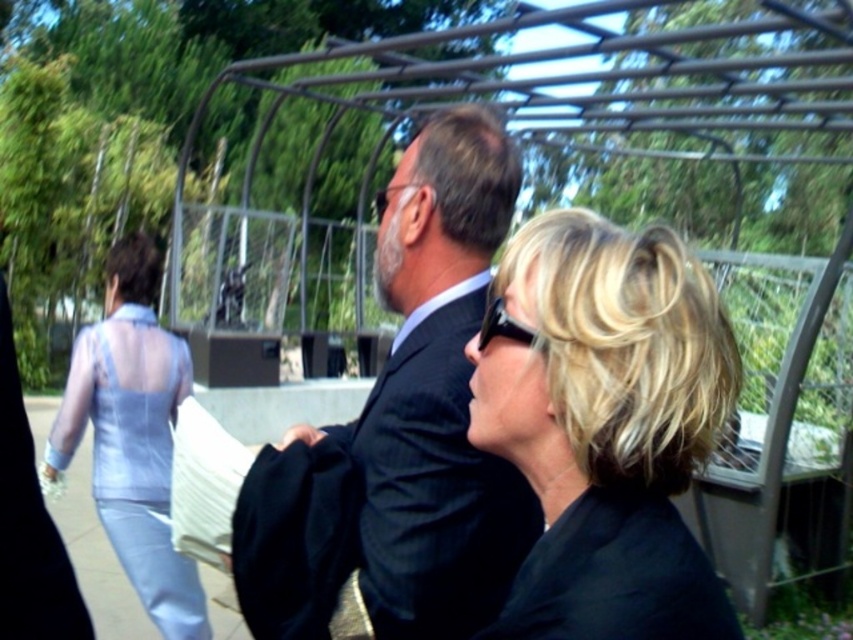
Question: Which of the following is the farthest from the observer?

Choices:
 (A) (497, 163)
 (B) (131, 545)

Answer: (B)

Question: Which object appears closest to the camera in this image?

Choices:
 (A) dark gray suit at center
 (B) blonde hair at center

Answer: (B)

Question: Which of these objects is positioned closest to the blonde hair at center?

Choices:
 (A) light blue sheer dress at left
 (B) dark gray suit at center

Answer: (B)

Question: Does dark gray suit at center appear on the left side of light blue sheer dress at left?

Choices:
 (A) no
 (B) yes

Answer: (A)

Question: Observing the image, what is the correct spatial positioning of blonde hair at center in reference to dark gray suit at center?

Choices:
 (A) right
 (B) left

Answer: (A)

Question: Does dark gray suit at center have a greater width compared to light blue sheer dress at left?

Choices:
 (A) yes
 (B) no

Answer: (B)